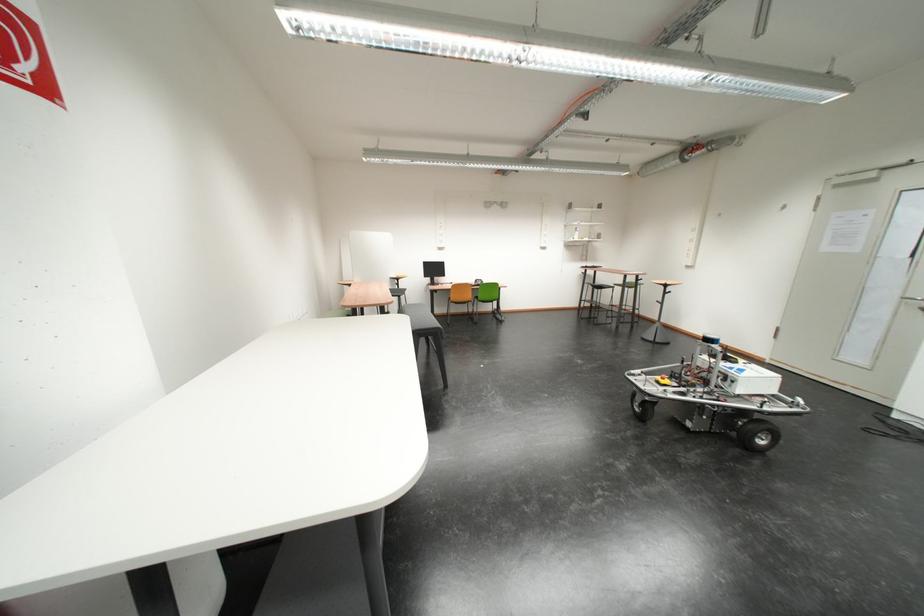
This screenshot has width=924, height=616. Find the location of `red robot button`. red robot button is located at coordinates (670, 381).